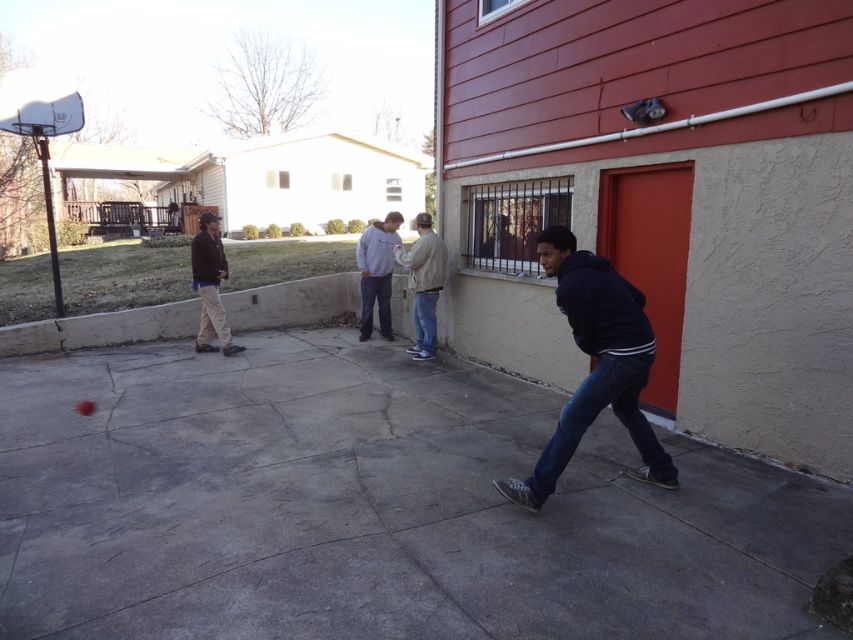
You are standing on the gray concrete pavement at center and want to shoot a basketball into the white plastic basketball hoop at upper left. Can you reach the hoop from your current position without moving?

The distance between the gray concrete pavement at center and the white plastic basketball hoop at upper left is 36.67 feet, which is too far for a typical basketball shot. You would need to move closer to the hoop to make a successful shot.

You are standing at the point labeled point (740,611) and want to throw a ball to someone standing 2.77 meters away. Is the distance sufficient to reach them in one throw?

Yes, the distance between you and the other person is 2.77 meters, which is within a typical throwing range for most people, so you can reach them in one throw.

You are standing at the edge of the gray concrete pavement at center. If you look directly ahead, which direction would you face?

Since the gray concrete pavement at center is located at point (373,508), facing directly ahead would mean looking toward the direction of the coordinates increasing from your position on the pavement.